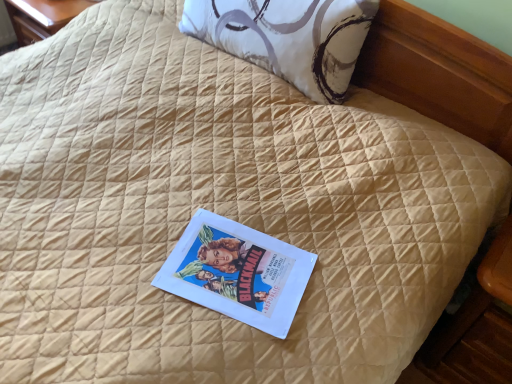
Question: From a real-world perspective, is white printed pillow at upper center positioned over matte paper book at center based on gravity?

Choices:
 (A) no
 (B) yes

Answer: (B)

Question: Is white printed pillow at upper center positioned far away from matte paper book at center?

Choices:
 (A) no
 (B) yes

Answer: (A)

Question: Can you confirm if white printed pillow at upper center is bigger than matte paper book at center?

Choices:
 (A) yes
 (B) no

Answer: (A)

Question: Does white printed pillow at upper center have a greater width compared to matte paper book at center?

Choices:
 (A) yes
 (B) no

Answer: (B)

Question: Does white printed pillow at upper center appear on the left side of matte paper book at center?

Choices:
 (A) yes
 (B) no

Answer: (B)

Question: Is matte paper book at center located within white printed pillow at upper center?

Choices:
 (A) no
 (B) yes

Answer: (A)

Question: Considering the relative sizes of matte paper book at center and white printed pillow at upper center in the image provided, is matte paper book at center smaller than white printed pillow at upper center?

Choices:
 (A) yes
 (B) no

Answer: (A)

Question: Is matte paper book at center completely or partially outside of white printed pillow at upper center?

Choices:
 (A) no
 (B) yes

Answer: (B)

Question: Is matte paper book at center looking in the opposite direction of white printed pillow at upper center?

Choices:
 (A) yes
 (B) no

Answer: (B)

Question: Is matte paper book at center shorter than white printed pillow at upper center?

Choices:
 (A) no
 (B) yes

Answer: (B)

Question: From the image's perspective, is matte paper book at center below white printed pillow at upper center?

Choices:
 (A) yes
 (B) no

Answer: (A)

Question: Can you confirm if matte paper book at center is wider than white printed pillow at upper center?

Choices:
 (A) yes
 (B) no

Answer: (A)

Question: From their relative heights in the image, would you say white printed pillow at upper center is taller or shorter than matte paper book at center?

Choices:
 (A) short
 (B) tall

Answer: (B)